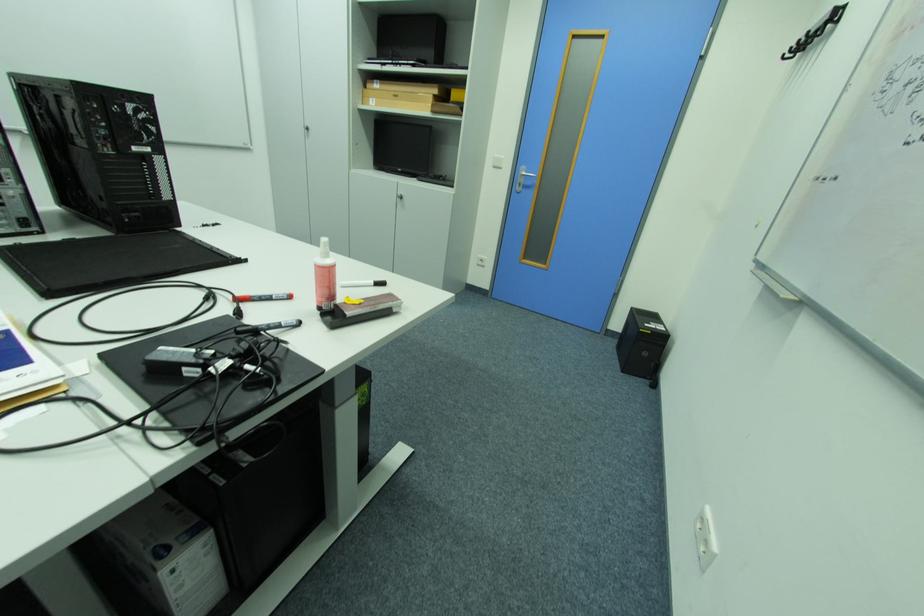
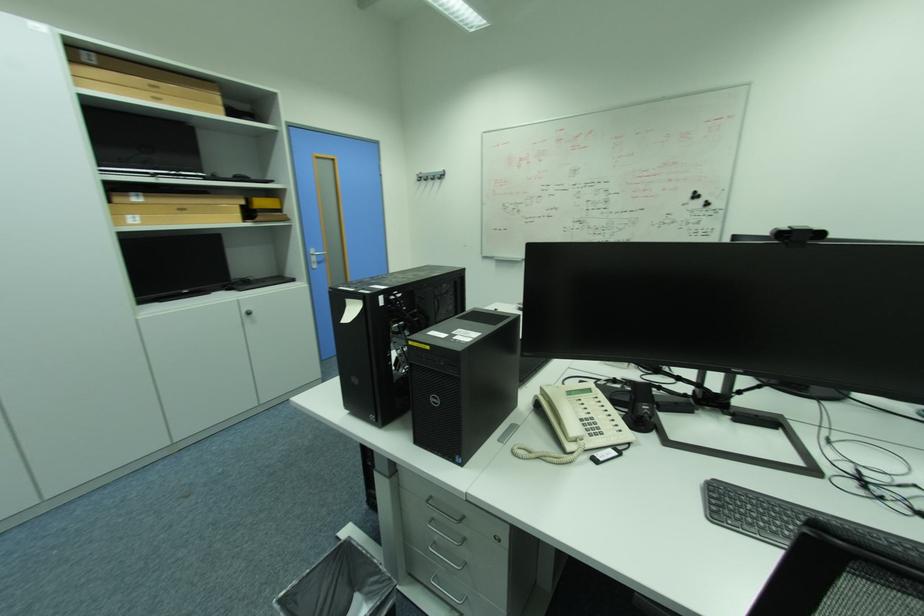
In the second image, find the point that corresponds to (379,100) in the first image.

(136, 217)